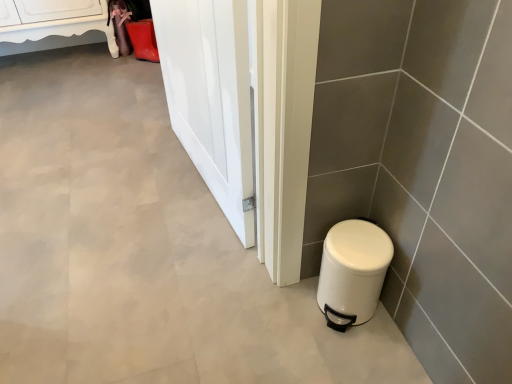
This screenshot has width=512, height=384. In order to click on free space between white glossy cabinet at upper left and white glossy door at center in this screenshot , I will do `click(110, 110)`.